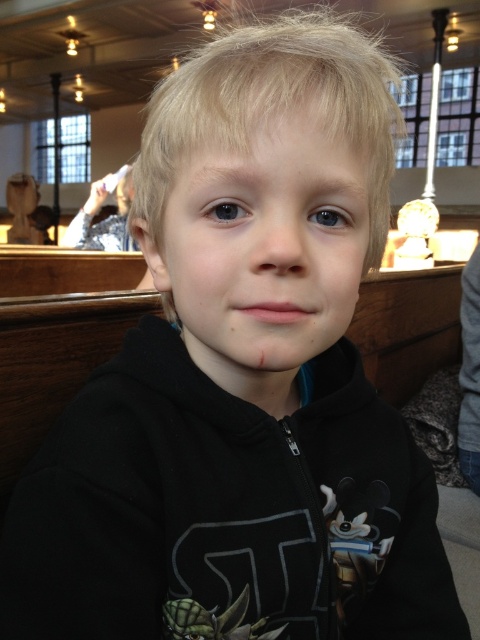
Based on the scene description, can you determine if the smooth skin face at center is located below the silver metallic statue at upper left?

Yes, the smooth skin face at center is positioned under the silver metallic statue at upper left, so it is located below it.

Based on the scene description, can you determine which object is taller between the smooth skin face at center and the silver metallic statue at upper left?

The smooth skin face at center is shorter than the silver metallic statue at upper left, so the silver metallic statue at upper left is taller.

Based on the scene description, can you determine which object is larger between the smooth skin face at center and the silver metallic statue at upper left?

The smooth skin face at center is smaller than the silver metallic statue at upper left, so the silver metallic statue at upper left is larger.